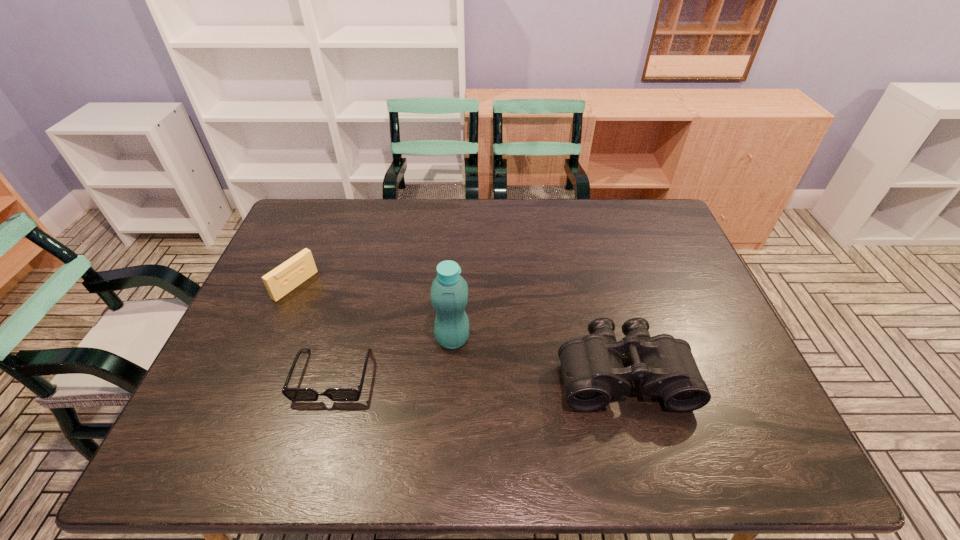
Where is `vacant space situated at the front of the videotape with spools`? vacant space situated at the front of the videotape with spools is located at coordinates (335, 312).

In order to click on free space located 0.260m at the front cap of the tallest object in this screenshot , I will do `click(558, 394)`.

You are a GUI agent. You are given a task and a screenshot of the screen. Output one action in this format:
    pyautogui.click(x=<x>, y=<y>)
    Task: Click on the vacant area located at the front cap of the tallest object
    The width and height of the screenshot is (960, 540).
    Given the screenshot: What is the action you would take?
    pyautogui.click(x=483, y=355)

Identify the location of free space located 0.100m at the front cap of the tallest object. This screenshot has width=960, height=540. (500, 363).

This screenshot has width=960, height=540. I want to click on sunglasses that is at the near edge, so click(x=293, y=394).

You are a GUI agent. You are given a task and a screenshot of the screen. Output one action in this format:
    pyautogui.click(x=<x>, y=<y>)
    Task: Click on the binoculars located at the near edge
    The width and height of the screenshot is (960, 540).
    Given the screenshot: What is the action you would take?
    pyautogui.click(x=593, y=372)

In order to click on object situated at the left edge in this screenshot , I will do `click(280, 281)`.

Where is `object situated at the right edge`? The height and width of the screenshot is (540, 960). object situated at the right edge is located at coordinates (593, 372).

Where is `object that is at the near right corner`? The height and width of the screenshot is (540, 960). object that is at the near right corner is located at coordinates pos(593,372).

You are a GUI agent. You are given a task and a screenshot of the screen. Output one action in this format:
    pyautogui.click(x=<x>, y=<y>)
    Task: Click on the free spot at the far edge of the desktop
    This screenshot has width=960, height=540.
    Given the screenshot: What is the action you would take?
    pyautogui.click(x=535, y=206)